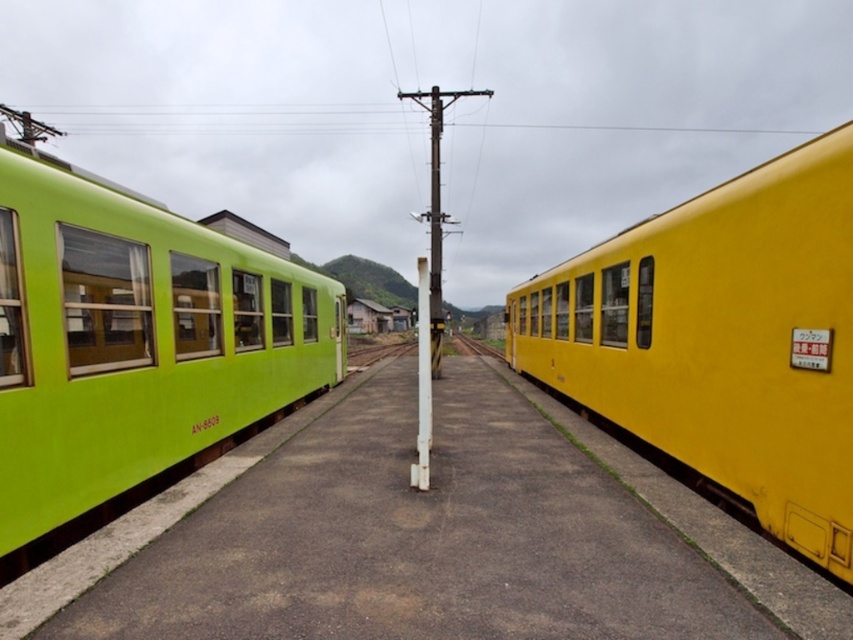
You are a maintenance worker inspecting the railway station. You need to determine if the lime green plastic train at left can be moved along the smooth concrete train track at center. Can it fit?

The lime green plastic train at left is bigger than the smooth concrete train track at center, so it cannot fit on the track.

You are standing at the point marked by the coordinates [132,348] in the railway station. Which train are you closest to?

The point marked by the coordinates [132,348] is closest to the lime green plastic train at left.

You are a maintenance worker needing to cross between the two trains. The safety regulations require a minimum clearance of 3 meters between obstacles. Can you safely walk between the matte green train at left and the yellow matte train at right?

The matte green train at left and yellow matte train at right are 3.40 meters apart from each other, which exceeds the required 3 meters clearance. Therefore, it is safe to walk between them.